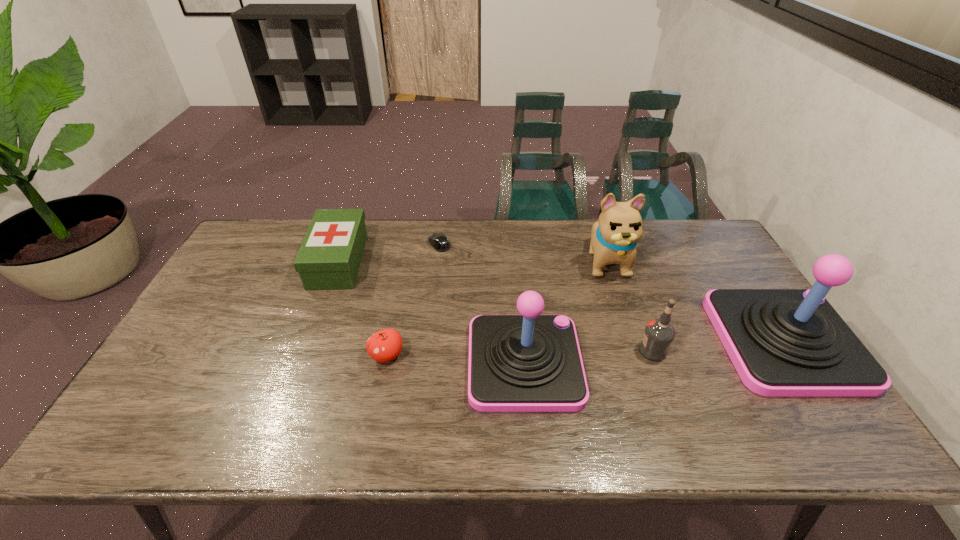
At what (x,y) coordinates should I click in order to perform the action: click on free space at the far right corner of the desktop. Please return your answer as a coordinate pair (x, y). The height and width of the screenshot is (540, 960). Looking at the image, I should click on (705, 227).

This screenshot has width=960, height=540. In order to click on blank area at the near right corner in this screenshot , I will do `click(824, 402)`.

In order to click on free area in between the vodka and the puppy in this screenshot , I will do `click(630, 306)`.

This screenshot has height=540, width=960. What are the coordinates of `vacant point located between the fourth tallest object and the taller joystick` in the screenshot? It's located at (719, 346).

This screenshot has height=540, width=960. In order to click on free point between the taller joystick and the mouse in this screenshot , I will do `click(612, 293)`.

Identify the location of free space between the taller joystick and the shortest object. This screenshot has height=540, width=960. (612, 293).

Identify the location of vacant area that lies between the taller joystick and the fourth tallest object. coord(719,346).

Where is `vacant point located between the first-aid kit and the shortest object`? This screenshot has width=960, height=540. vacant point located between the first-aid kit and the shortest object is located at coordinates (389, 253).

This screenshot has width=960, height=540. What are the coordinates of `vacant area between the fourth object from right to left and the second shortest object` in the screenshot? It's located at (456, 359).

The height and width of the screenshot is (540, 960). In order to click on free space that is in between the shorter joystick and the sixth tallest object in this screenshot , I will do `click(456, 359)`.